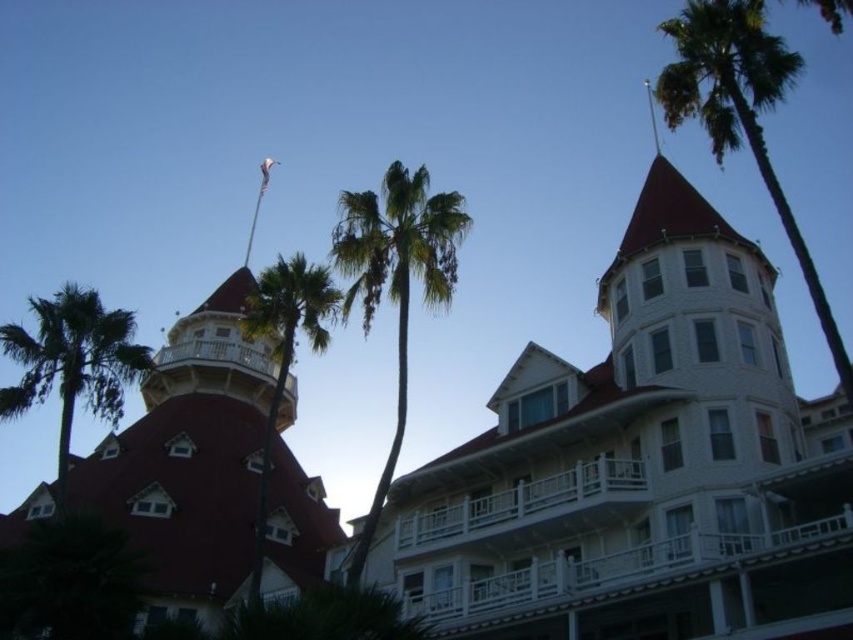
Question: Which point is closer to the camera taking this photo?

Choices:
 (A) (28, 380)
 (B) (386, 196)
 (C) (482, 492)
 (D) (215, 408)

Answer: (A)

Question: Does smooth red tower at left have a greater width compared to green leafy palm tree at center?

Choices:
 (A) no
 (B) yes

Answer: (B)

Question: Considering the relative positions of smooth red tower at left and green leafy palm tree at upper right in the image provided, where is smooth red tower at left located with respect to green leafy palm tree at upper right?

Choices:
 (A) below
 (B) above

Answer: (A)

Question: Can you confirm if white textured building at center is positioned to the right of green leafy palm tree at center?

Choices:
 (A) no
 (B) yes

Answer: (B)

Question: Among these points, which one is farthest from the camera?

Choices:
 (A) (850, 502)
 (B) (202, 349)

Answer: (B)

Question: Which object is the closest to the green leafy palm tree at left?

Choices:
 (A) white textured building at center
 (B) green leafy palm tree at center

Answer: (B)